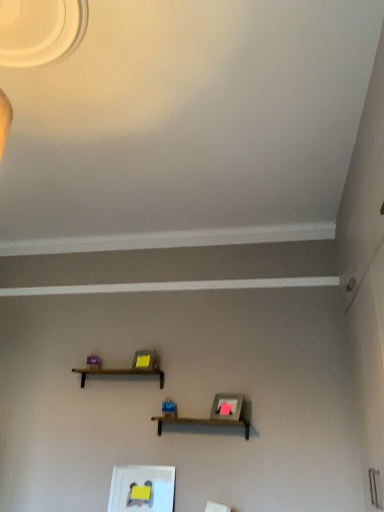
What do you see at coordinates (141, 486) in the screenshot? I see `matte white picture frame at lower center` at bounding box center [141, 486].

You are a GUI agent. You are given a task and a screenshot of the screen. Output one action in this format:
    pyautogui.click(x=<x>, y=<y>)
    Task: Click on the matte white picture frame at lower center
    This screenshot has height=512, width=384.
    Given the screenshot: What is the action you would take?
    pyautogui.click(x=141, y=486)

Measure the distance between point (74, 368) and camera.

Point (74, 368) and camera are 10.88 feet apart from each other.

What do you see at coordinates (119, 373) in the screenshot? I see `brown wooden shelf at center` at bounding box center [119, 373].

Image resolution: width=384 pixels, height=512 pixels. What are the coordinates of `brown wooden shelf at center` in the screenshot? It's located at (119, 373).

Identify the location of matte white picture frame at lower center. The width and height of the screenshot is (384, 512). (141, 486).

Which object is positioned more to the left, matte white picture frame at lower center or brown wooden shelf at center?

Positioned to the left is brown wooden shelf at center.

Which is in front, matte white picture frame at lower center or brown wooden shelf at center?

matte white picture frame at lower center is in front.

Is point (115, 473) positioned before point (163, 383)?

Yes, point (115, 473) is in front of point (163, 383).

From the image's perspective, is matte white picture frame at lower center above or below brown wooden shelf at center?

From the image's perspective, matte white picture frame at lower center appears below brown wooden shelf at center.

From a real-world perspective, is matte white picture frame at lower center located higher than brown wooden shelf at center?

No.

Considering the relative sizes of matte white picture frame at lower center and brown wooden shelf at center in the image provided, is matte white picture frame at lower center thinner than brown wooden shelf at center?

Correct, the width of matte white picture frame at lower center is less than that of brown wooden shelf at center.

Based on the photo, in terms of height, does matte white picture frame at lower center look taller or shorter compared to brown wooden shelf at center?

Considering their sizes, matte white picture frame at lower center has more height than brown wooden shelf at center.

Can you confirm if matte white picture frame at lower center is bigger than brown wooden shelf at center?

No, matte white picture frame at lower center is not bigger than brown wooden shelf at center.

Looking at this image, would you say matte white picture frame at lower center is inside or outside brown wooden shelf at center?

matte white picture frame at lower center is spatially situated outside brown wooden shelf at center.

Is matte white picture frame at lower center placed right next to brown wooden shelf at center?

matte white picture frame at lower center and brown wooden shelf at center are not in contact.

Is matte white picture frame at lower center oriented towards brown wooden shelf at center?

No, matte white picture frame at lower center is not aimed at brown wooden shelf at center.

What's the angular difference between matte white picture frame at lower center and brown wooden shelf at center's facing directions?

The angle between the facing direction of matte white picture frame at lower center and the facing direction of brown wooden shelf at center is 0.488 degrees.

The width and height of the screenshot is (384, 512). Find the location of `picture frame located underneath the brown wooden shelf at center (from a real-world perspective)`. picture frame located underneath the brown wooden shelf at center (from a real-world perspective) is located at coordinates (141, 486).

Is brown wooden shelf at center to the left of matte white picture frame at lower center from the viewer's perspective?

Indeed, brown wooden shelf at center is positioned on the left side of matte white picture frame at lower center.

Which object is closer to the camera taking this photo, brown wooden shelf at center or matte white picture frame at lower center?

matte white picture frame at lower center is in front.

Which point is more forward, [150,369] or [123,471]?

The point [123,471] is closer to the camera.

From the image's perspective, which one is positioned higher, brown wooden shelf at center or matte white picture frame at lower center?

From the image's view, brown wooden shelf at center is above.

From a real-world perspective, is brown wooden shelf at center above or below matte white picture frame at lower center?

In terms of real-world spatial position, brown wooden shelf at center is above matte white picture frame at lower center.

Which of these two, brown wooden shelf at center or matte white picture frame at lower center, is wider?

brown wooden shelf at center.

Can you confirm if brown wooden shelf at center is taller than matte white picture frame at lower center?

In fact, brown wooden shelf at center may be shorter than matte white picture frame at lower center.

In terms of size, does brown wooden shelf at center appear bigger or smaller than matte white picture frame at lower center?

In the image, brown wooden shelf at center appears to be larger than matte white picture frame at lower center.

In the scene shown: Would you say matte white picture frame at lower center is part of brown wooden shelf at center's contents?

No, matte white picture frame at lower center is located outside of brown wooden shelf at center.

Is brown wooden shelf at center far from matte white picture frame at lower center?

No.

Is brown wooden shelf at center facing away from matte white picture frame at lower center?

brown wooden shelf at center does not have its back to matte white picture frame at lower center.

How much distance is there between brown wooden shelf at center and matte white picture frame at lower center?

brown wooden shelf at center and matte white picture frame at lower center are 26.71 inches apart from each other.

The height and width of the screenshot is (512, 384). What are the coordinates of `picture frame to the right of brown wooden shelf at center` in the screenshot? It's located at pos(141,486).

I want to click on picture frame that appears below the brown wooden shelf at center (from a real-world perspective), so click(141, 486).

You are a GUI agent. You are given a task and a screenshot of the screen. Output one action in this format:
    pyautogui.click(x=<x>, y=<y>)
    Task: Click on the shelf above the matte white picture frame at lower center (from the image's perspective)
    
    Given the screenshot: What is the action you would take?
    pyautogui.click(x=119, y=373)